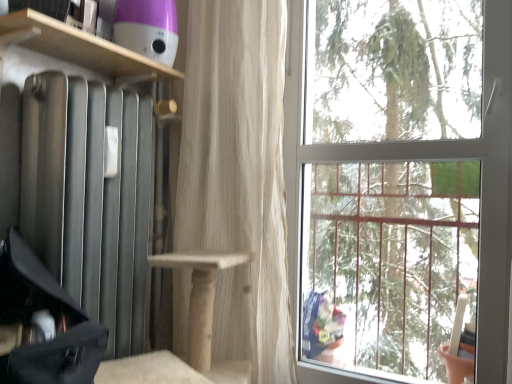
Question: Is black fabric suitcase at left positioned with its back to transparent glass window at upper right?

Choices:
 (A) no
 (B) yes

Answer: (A)

Question: Does black fabric suitcase at left have a larger size compared to transparent glass window at upper right?

Choices:
 (A) no
 (B) yes

Answer: (A)

Question: Is black fabric suitcase at left not near transparent glass window at upper right?

Choices:
 (A) no
 (B) yes

Answer: (B)

Question: Can you confirm if black fabric suitcase at left is positioned to the left of transparent glass window at upper right?

Choices:
 (A) yes
 (B) no

Answer: (A)

Question: Considering the relative positions of black fabric suitcase at left and transparent glass window at upper right in the image provided, is black fabric suitcase at left behind transparent glass window at upper right?

Choices:
 (A) yes
 (B) no

Answer: (B)

Question: Is wooden shelf at upper left situated inside black fabric suitcase at left or outside?

Choices:
 (A) outside
 (B) inside

Answer: (A)

Question: From a real-world perspective, is wooden shelf at upper left physically located above or below black fabric suitcase at left?

Choices:
 (A) above
 (B) below

Answer: (A)

Question: Considering their positions, is wooden shelf at upper left located in front of or behind black fabric suitcase at left?

Choices:
 (A) front
 (B) behind

Answer: (B)

Question: Considering the relative positions of wooden shelf at upper left and black fabric suitcase at left in the image provided, is wooden shelf at upper left to the left or to the right of black fabric suitcase at left?

Choices:
 (A) right
 (B) left

Answer: (A)

Question: Visually, is wooden shelf at upper left positioned to the left or to the right of white sheer curtain at center?

Choices:
 (A) right
 (B) left

Answer: (B)

Question: Considering the positions of wooden shelf at upper left and white sheer curtain at center in the image, is wooden shelf at upper left bigger or smaller than white sheer curtain at center?

Choices:
 (A) small
 (B) big

Answer: (A)

Question: In terms of width, does wooden shelf at upper left look wider or thinner when compared to white sheer curtain at center?

Choices:
 (A) wide
 (B) thin

Answer: (A)

Question: Is point (92, 56) closer or farther from the camera than point (209, 130)?

Choices:
 (A) farther
 (B) closer

Answer: (B)

Question: Considering the positions of white sheer curtain at center and black fabric suitcase at left in the image, is white sheer curtain at center bigger or smaller than black fabric suitcase at left?

Choices:
 (A) big
 (B) small

Answer: (A)

Question: From a real-world perspective, relative to black fabric suitcase at left, is white sheer curtain at center vertically above or below?

Choices:
 (A) above
 (B) below

Answer: (A)